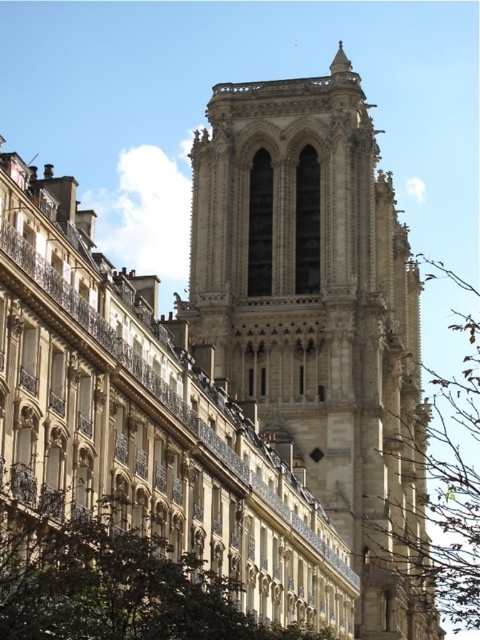
Question: Is beige stone tower at center wider than brown leafy tree at right?

Choices:
 (A) yes
 (B) no

Answer: (B)

Question: Is beige stone tower at center closer to the viewer compared to brown leafy tree at right?

Choices:
 (A) no
 (B) yes

Answer: (B)

Question: Is beige stone tower at center bigger than green leafy tree at lower left?

Choices:
 (A) no
 (B) yes

Answer: (B)

Question: Which point appears farthest from the camera in this image?

Choices:
 (A) [x=417, y=588]
 (B) [x=120, y=497]
 (C) [x=265, y=353]

Answer: (A)

Question: Which of the following is the closest to the observer?

Choices:
 (A) (195, 589)
 (B) (425, 456)

Answer: (A)

Question: Which of the following is the closest to the observer?

Choices:
 (A) (216, 269)
 (B) (479, 429)
 (C) (106, 545)

Answer: (C)